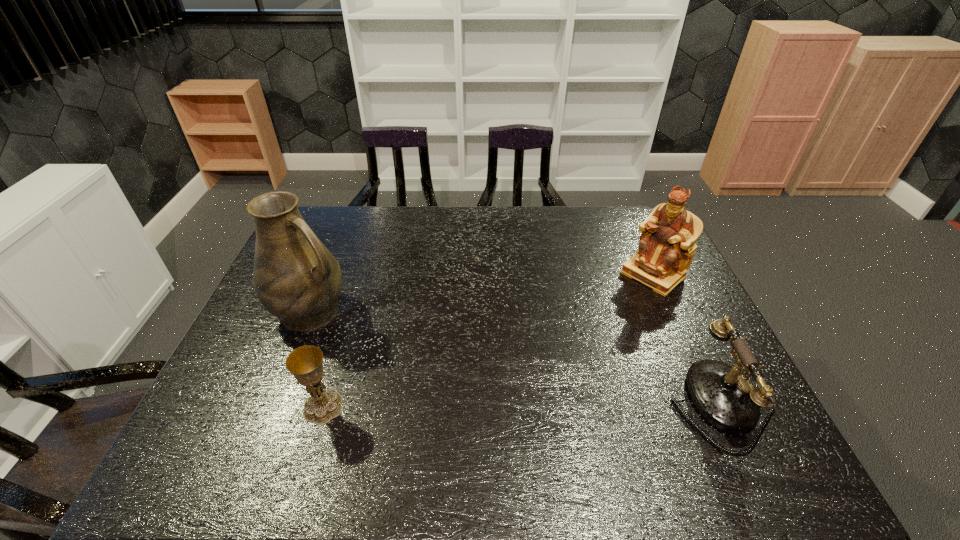
Locate an element on the screen. Image resolution: width=960 pixels, height=540 pixels. vacant space on the desktop that is between the chalice and the telephone and is positioned on the front-facing side of the second tallest object is located at coordinates (493, 406).

At what (x,y) coordinates should I click in order to perform the action: click on free spot on the desktop that is between the chalice and the telephone and is positioned on the handle side of the tallest object. Please return your answer as a coordinate pair (x, y). This screenshot has width=960, height=540. Looking at the image, I should click on (477, 406).